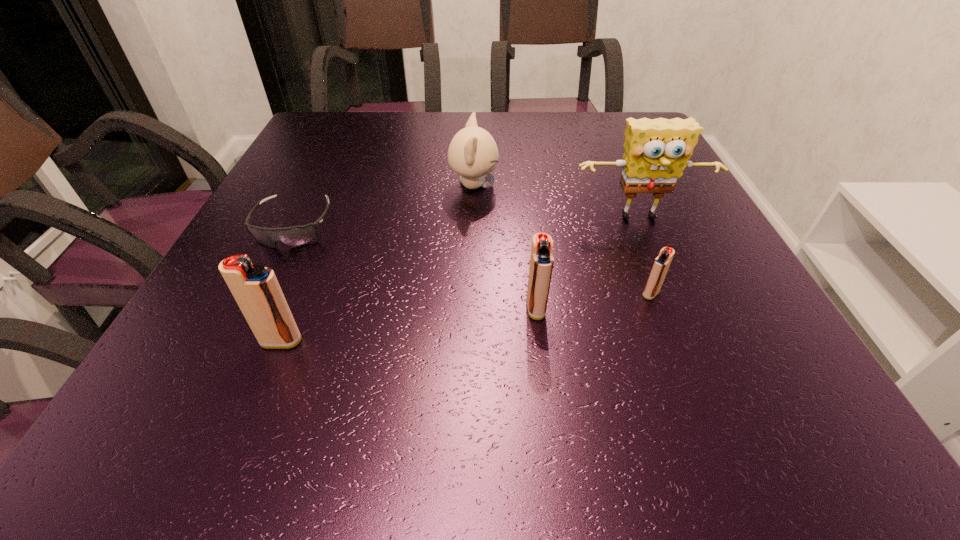
This screenshot has width=960, height=540. I want to click on object present at the near left corner, so click(x=255, y=288).

Locate an element on the screen. vacant space at the far edge of the desktop is located at coordinates point(561,132).

Identify the location of vacant space at the near edge of the desktop. (480, 335).

At what (x,y) coordinates should I click in order to perform the action: click on free location at the left edge. Please return your answer as a coordinate pair (x, y). The height and width of the screenshot is (540, 960). Looking at the image, I should click on (276, 274).

Where is `blank space at the far left corner`? The height and width of the screenshot is (540, 960). blank space at the far left corner is located at coordinates (362, 132).

The width and height of the screenshot is (960, 540). I want to click on vacant region between the third object from right to left and the nearest object, so click(408, 325).

Where is `unoccupied position between the kitten and the second igniter from right to left`? This screenshot has height=540, width=960. unoccupied position between the kitten and the second igniter from right to left is located at coordinates coord(505,247).

Where is `free spot between the fourth object from left to right and the kitten`? This screenshot has width=960, height=540. free spot between the fourth object from left to right and the kitten is located at coordinates (505, 247).

Where is `unoccupied area between the farthest object and the nearest igniter`? This screenshot has height=540, width=960. unoccupied area between the farthest object and the nearest igniter is located at coordinates (377, 264).

Image resolution: width=960 pixels, height=540 pixels. I want to click on free space between the second igniter from right to left and the farthest object, so click(x=505, y=247).